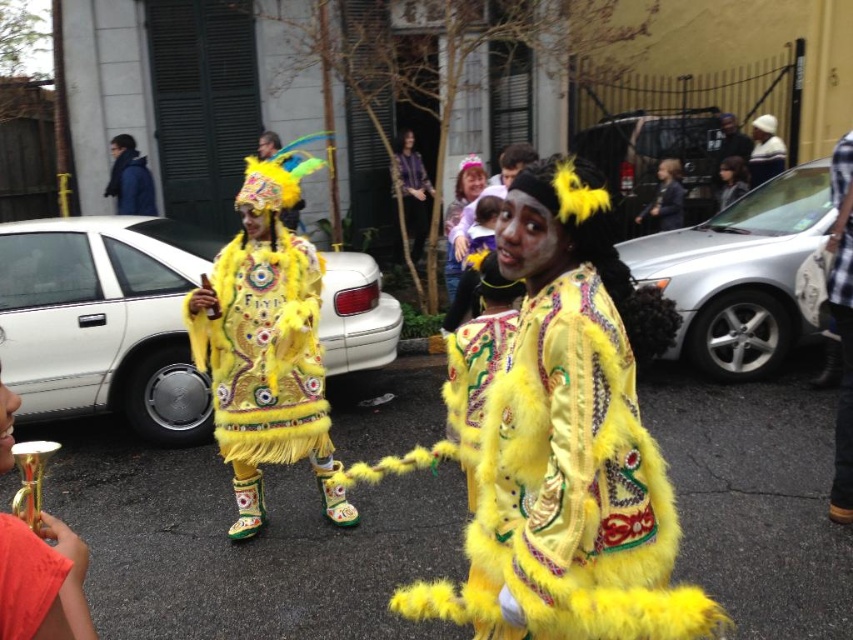
Does matte purple dress at center come in front of matte black jacket at center?

That is True.

Is point (465, 182) less distant than point (735, 157)?

Yes, it is.

You are a GUI agent. You are given a task and a screenshot of the screen. Output one action in this format:
    pyautogui.click(x=<x>, y=<y>)
    Task: Click on the matte purple dress at center
    The width and height of the screenshot is (853, 640).
    Given the screenshot: What is the action you would take?
    pyautogui.click(x=460, y=212)

Which is behind, point (566, 477) or point (845, 163)?

Positioned behind is point (845, 163).

Which is in front, point (547, 412) or point (840, 232)?

Positioned in front is point (547, 412).

Is point (607, 304) farther from camera compared to point (846, 180)?

That is False.

I want to click on yellow satin costume at center, so click(x=567, y=490).

Between matte purple dress at center and matte yellow costume at center, which one is positioned lower?

matte purple dress at center is below.

Is matte purple dress at center positioned behind matte yellow costume at center?

No, matte purple dress at center is closer to the viewer.

Describe the element at coordinates (460, 212) in the screenshot. The width and height of the screenshot is (853, 640). I see `matte purple dress at center` at that location.

Where is `matte purple dress at center`? The height and width of the screenshot is (640, 853). matte purple dress at center is located at coordinates (460, 212).